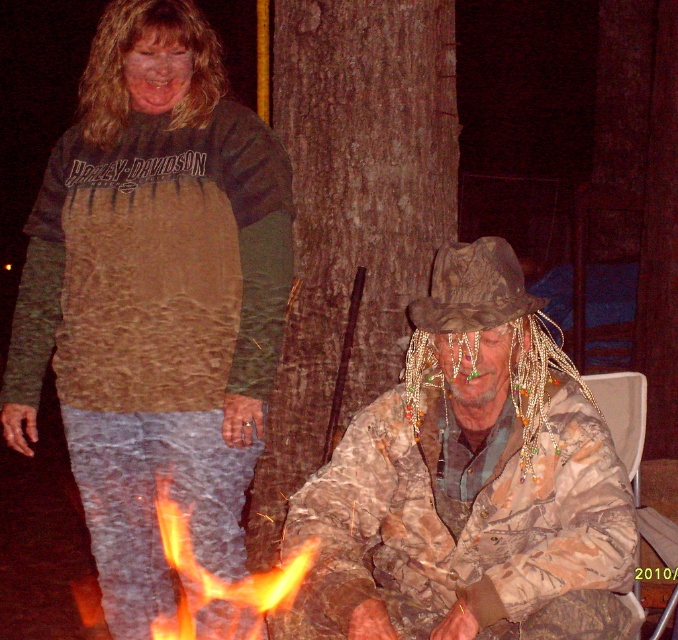
You are standing at point [511,273] and want to walk to point [191,540]. Which direction should you move in relation to the two points?

To move from point [511,273] to point [191,540], you should move forward since point [191,540] is behind point [511,273].

Based on the photo, you are trying to take a photo of the Harley Davidson shirt woman and the camouflage man. Where should you position the flameflame at lower center in relation to the two people to ensure both are fully visible in the frame?

The flameflame at lower center is located at point (216, 582), so you should position it at that coordinate to ensure both the Harley Davidson shirt woman and the camouflage man are fully visible in the frame.

You are a photographer taking a picture of the flameflame at lower center and the camouflage fabric cowboy hat at center. Which object will appear larger in your photo?

The flameflame at lower center will appear larger in your photo because it is closer to the viewer than the camouflage fabric cowboy hat at center.